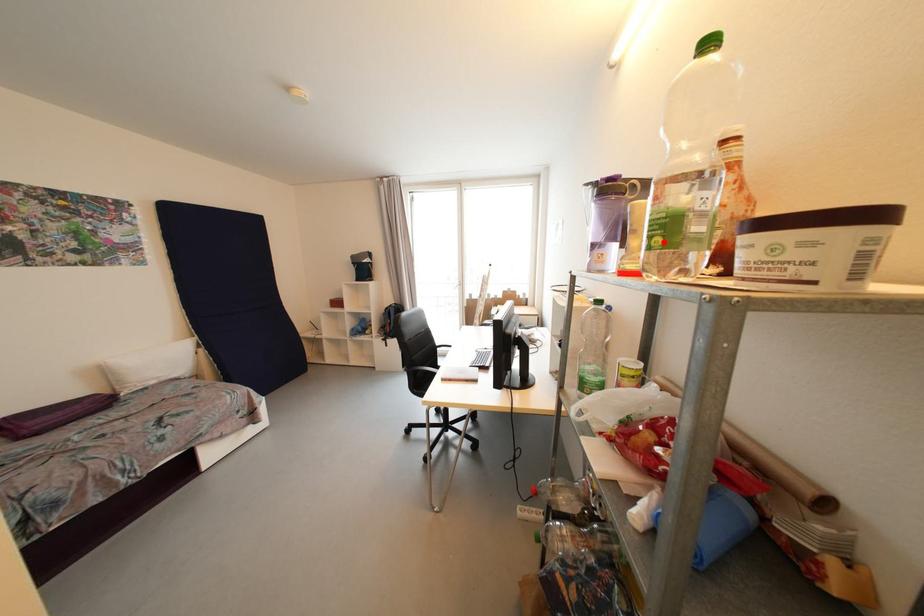
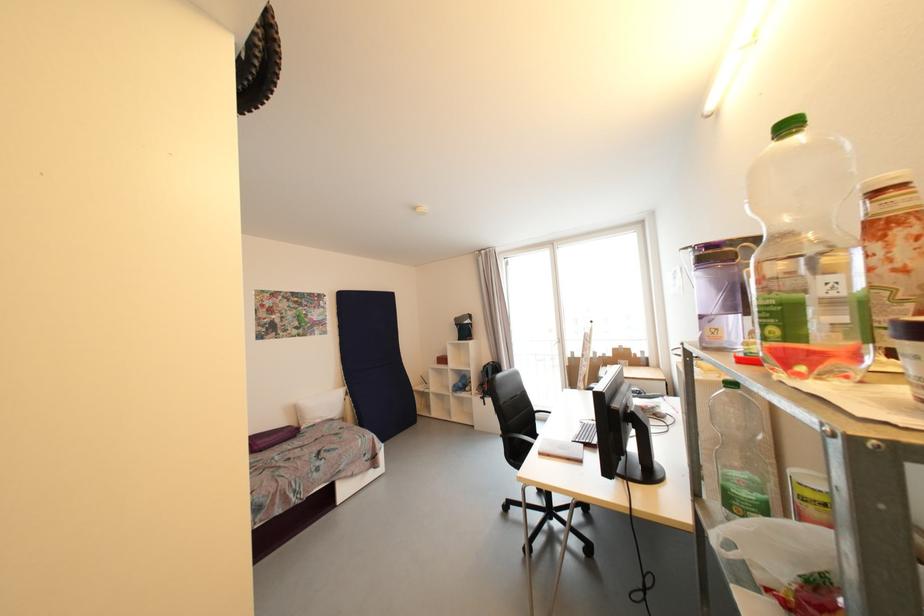
Find the pixel in the second image that matches the highlighted location in the first image.

(780, 331)